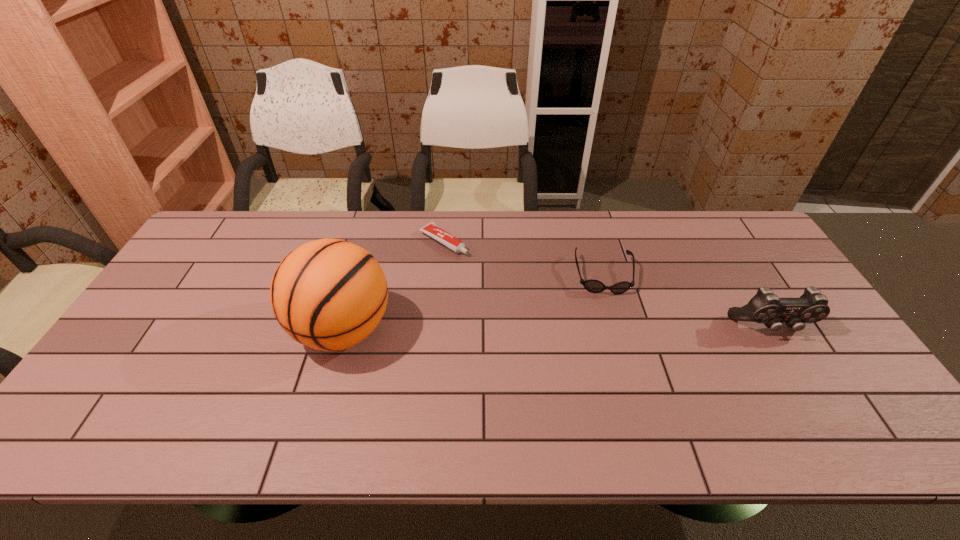
Locate an element on the screen. The width and height of the screenshot is (960, 540). vacant position located 0.130m on the lenses of the second shortest object is located at coordinates (613, 330).

You are a GUI agent. You are given a task and a screenshot of the screen. Output one action in this format:
    pyautogui.click(x=<x>, y=<y>)
    Task: Click on the free location located 0.080m on the lenses of the second shortest object
    The height and width of the screenshot is (540, 960).
    Given the screenshot: What is the action you would take?
    (611, 317)

Find the location of a particular element. Image resolution: width=960 pixels, height=540 pixels. vacant space located 0.050m on the lenses of the second shortest object is located at coordinates (610, 309).

Identify the location of free space located 0.310m at the nozzle of the second object from left to right. (536, 302).

Locate an element on the screen. Image resolution: width=960 pixels, height=540 pixels. vacant space located 0.310m at the nozzle of the second object from left to right is located at coordinates (536, 302).

Locate an element on the screen. free spot located at the nozzle of the second object from left to right is located at coordinates (517, 290).

The height and width of the screenshot is (540, 960). I want to click on object that is at the far edge, so click(431, 229).

The height and width of the screenshot is (540, 960). I want to click on object located at the right edge, so click(x=765, y=307).

Identify the location of free region at the far edge. (715, 251).

Where is `vacant space at the near edge of the desktop`? This screenshot has width=960, height=540. vacant space at the near edge of the desktop is located at coordinates (739, 386).